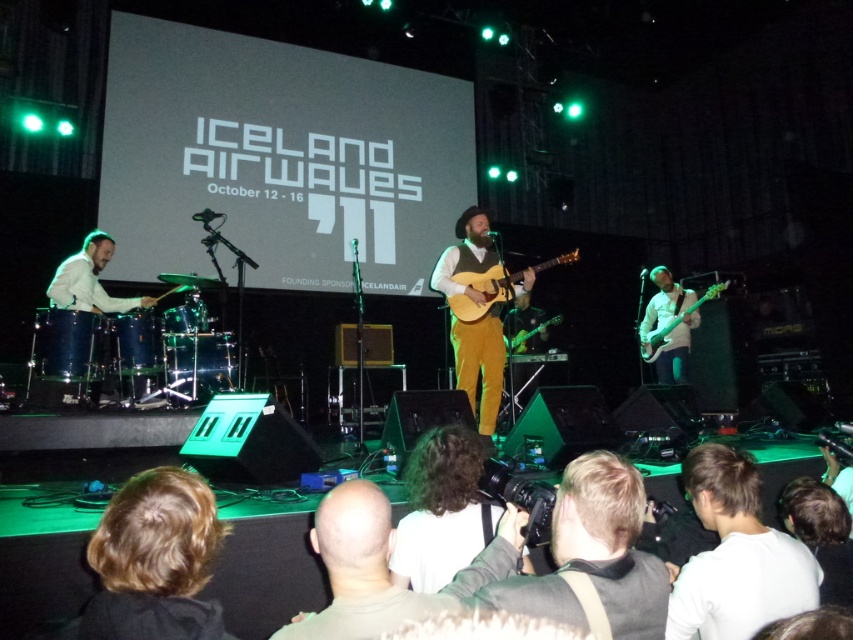
Does mustard yellow fabric suit at center have a greater width compared to light brown wooden guitar at center?

No, mustard yellow fabric suit at center is not wider than light brown wooden guitar at center.

Does mustard yellow fabric suit at center appear on the right side of light brown wooden guitar at center?

No, mustard yellow fabric suit at center is not to the right of light brown wooden guitar at center.

Which is behind, point (469, 240) or point (465, 269)?

The point (469, 240) is behind.

Find the location of `mustard yellow fabric suit at center`. mustard yellow fabric suit at center is located at coordinates (479, 364).

Is white cotton shirt at lower right positioned behind light brown wooden guitar at center?

No, it is not.

How distant is white cotton shirt at lower right from light brown wooden guitar at center?

white cotton shirt at lower right is 2.63 meters from light brown wooden guitar at center.

Locate an element on the screen. This screenshot has width=853, height=640. white cotton shirt at lower right is located at coordinates (735, 556).

Which is in front, point (491, 397) or point (518, 332)?

Point (491, 397) is more forward.

Is point (462, 285) less distant than point (519, 337)?

Yes, it is.

Image resolution: width=853 pixels, height=640 pixels. I want to click on mustard yellow fabric suit at center, so click(x=479, y=364).